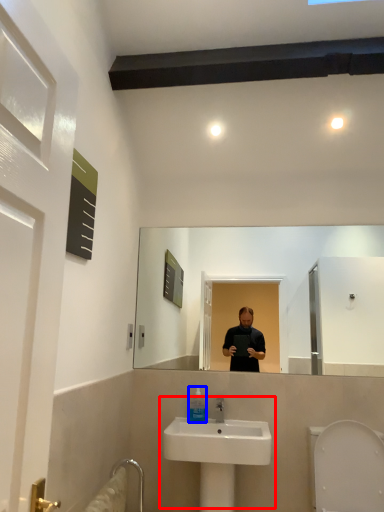
Question: Which point is further to the camera, sink (highlighted by a red box) or mouthwash (highlighted by a blue box)?

Choices:
 (A) sink
 (B) mouthwash

Answer: (B)